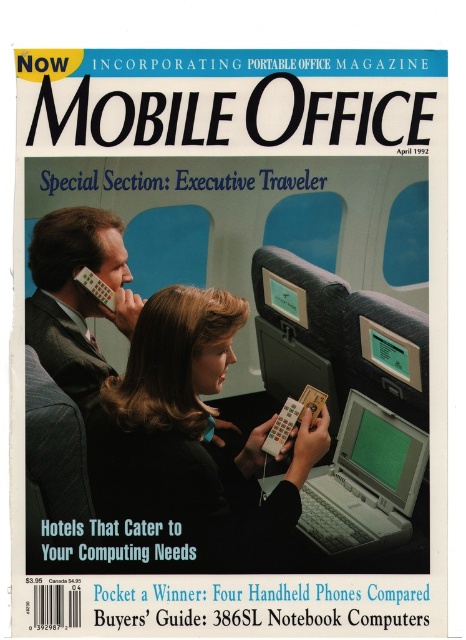
You are an office worker trying to set up your laptop for a video call during a flight. You notice the matte black laptop at center and the matte gray suit at left. Which object is located to the right of the other?

The matte black laptop at center is positioned on the right side of the matte gray suit at left.

You are a flight attendant checking the overhead compartments. You notice the matte black laptop at center and the matte gray suit at left. Which item is taller?

The matte black laptop at center is taller than the matte gray suit at left.

Looking at this image, you are an office equipment salesperson. You see the matte black laptop at center and the gray plastic laptop at center in the magazine cover image. Which laptop would you recommend to a client who needs a portable device for travel?

The gray plastic laptop at center is smaller in size than the matte black laptop at center, so it would be more portable for travel purposes.